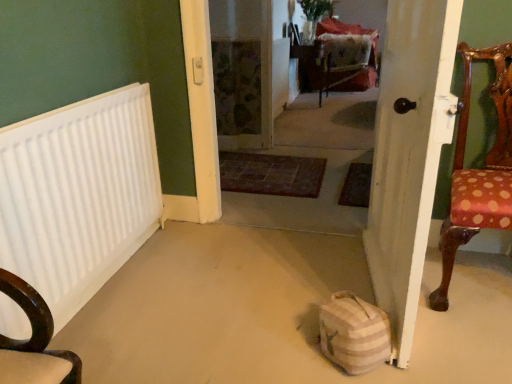
Image resolution: width=512 pixels, height=384 pixels. I want to click on unoccupied area in front of white matte radiator at left, so click(x=123, y=336).